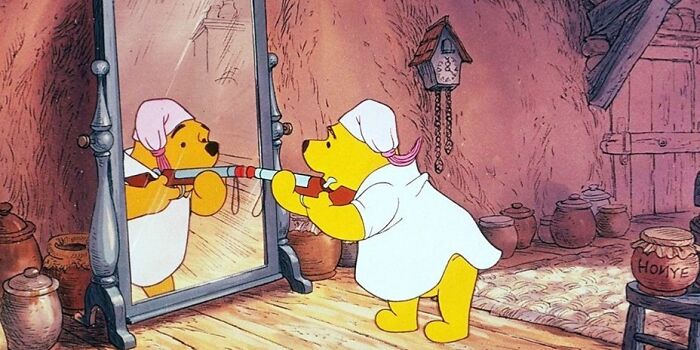
Where is `winnie the pooh's night cap`? The height and width of the screenshot is (350, 700). winnie the pooh's night cap is located at coordinates (157, 125), (385, 127).